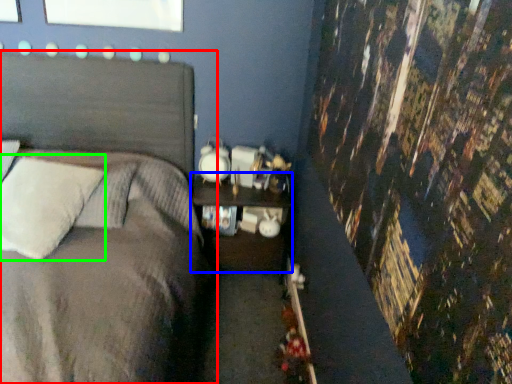
Question: Estimate the real-world distances between objects in this image. Which object is farther from bed (highlighted by a red box), nightstand (highlighted by a blue box) or pillow (highlighted by a green box)?

Choices:
 (A) nightstand
 (B) pillow

Answer: (A)